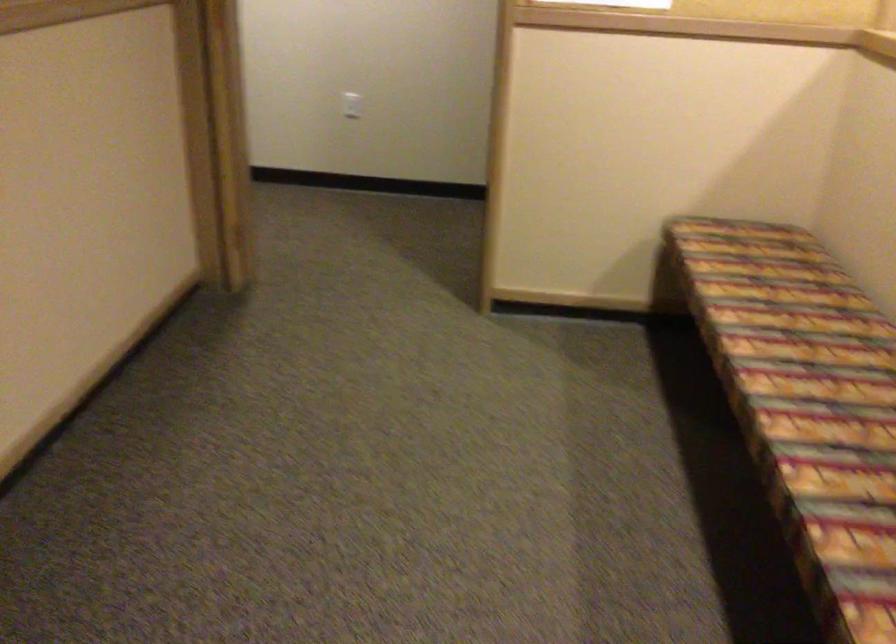
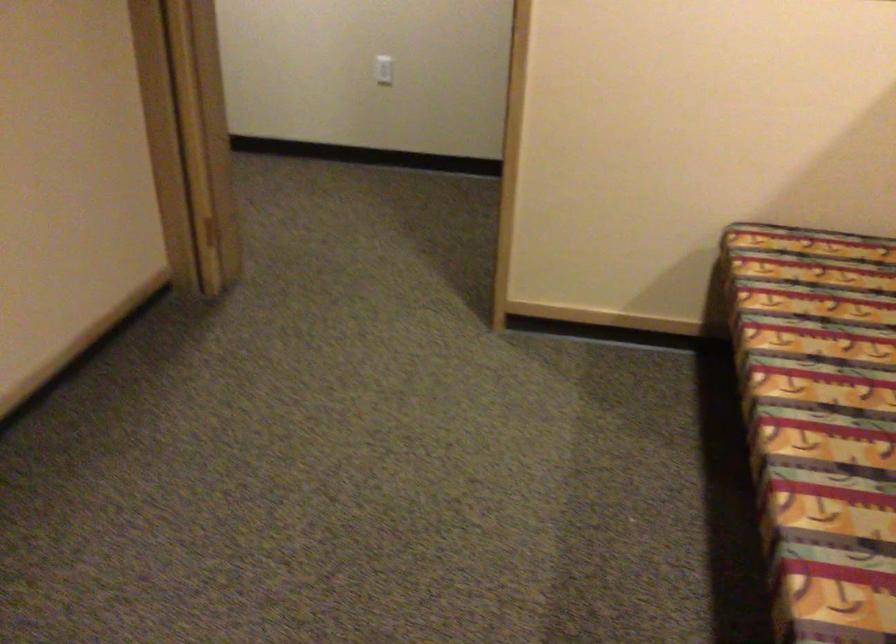
Locate, in the second image, the point that corresponds to point (760, 337) in the first image.

(819, 422)